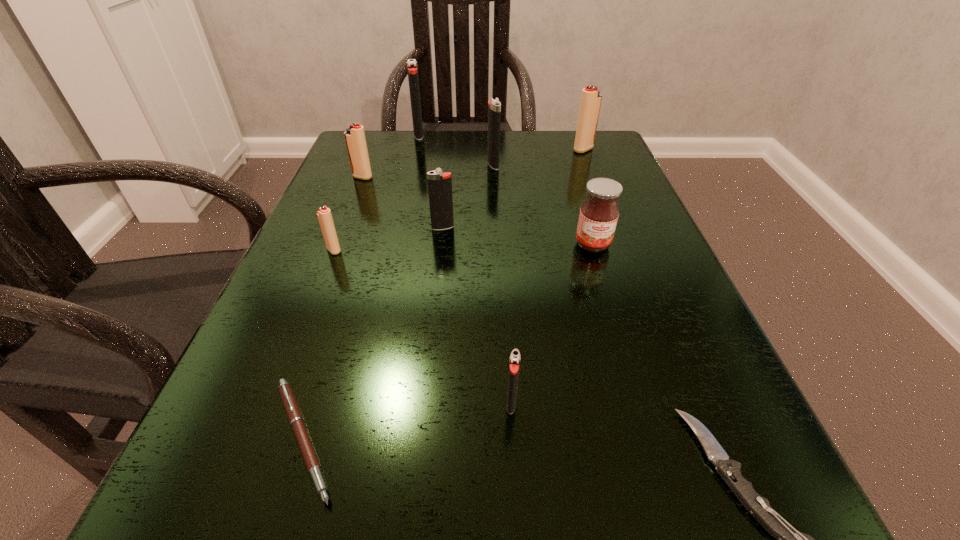
Where is `black igniter that is the third closest to the tallest object`? The image size is (960, 540). black igniter that is the third closest to the tallest object is located at coordinates (514, 365).

Where is `the third closest black igniter to the biggest red igniter`? the third closest black igniter to the biggest red igniter is located at coordinates (439, 184).

Choose which red igniter is the nearest neighbor to the sixth farthest igniter. Please provide its 2D coordinates. Your answer should be formatted as a tuple, i.e. [(x, y)], where the tuple contains the x and y coordinates of a point satisfying the conditions above.

[(355, 139)]

Select which red igniter appears as the second closest to the biggest black igniter. Please provide its 2D coordinates. Your answer should be formatted as a tuple, i.e. [(x, y)], where the tuple contains the x and y coordinates of a point satisfying the conditions above.

[(590, 104)]

Image resolution: width=960 pixels, height=540 pixels. I want to click on vacant space that satisfies the following two spatial constraints: 1. on the front side of the leftmost black igniter; 2. at the nib of the pen, so click(x=346, y=439).

Find the location of a particular element. The width and height of the screenshot is (960, 540). free spot that satisfies the following two spatial constraints: 1. on the front side of the tallest object; 2. on the right side of the fifth nearest igniter is located at coordinates (412, 165).